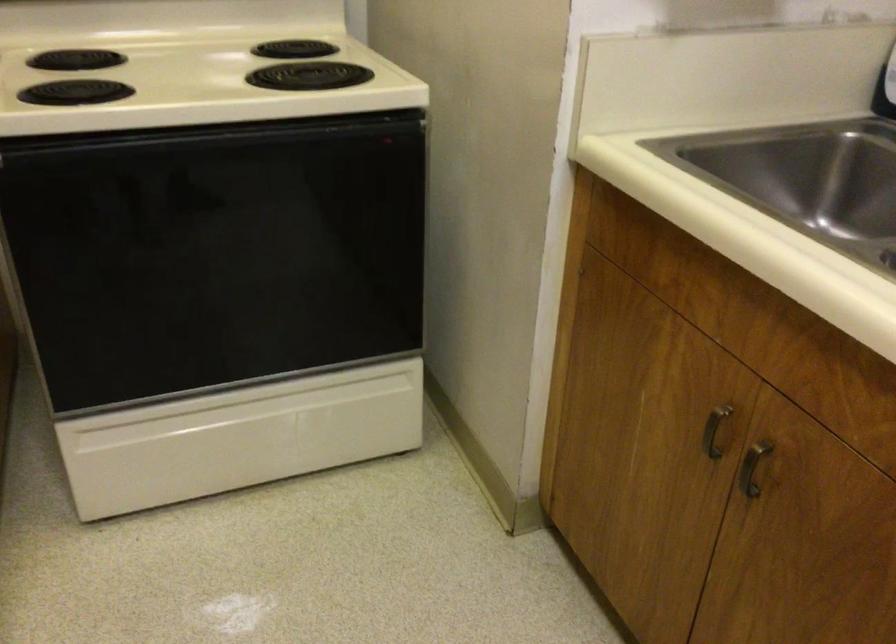
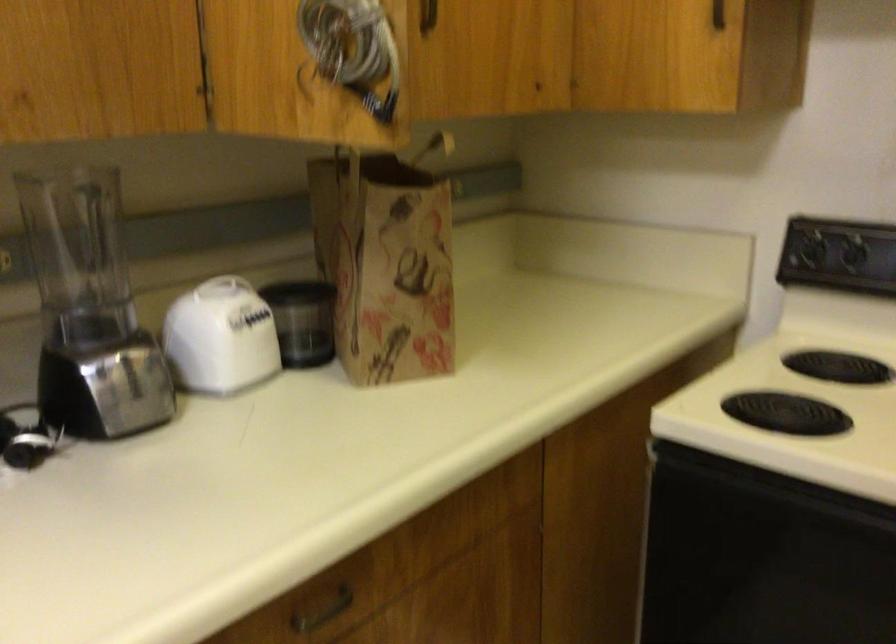
Question: The first image is from the beginning of the video and the second image is from the end. How did the camera likely rotate when shooting the video?

Choices:
 (A) Left
 (B) Right
 (C) Up
 (D) Down

Answer: (A)